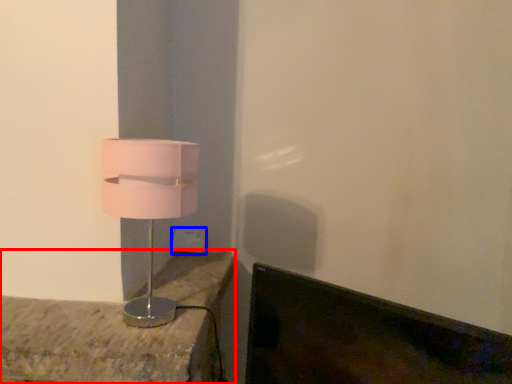
Question: Which object appears farthest to the camera in this image, furniture (highlighted by a red box) or electric outlet (highlighted by a blue box)?

Choices:
 (A) furniture
 (B) electric outlet

Answer: (B)